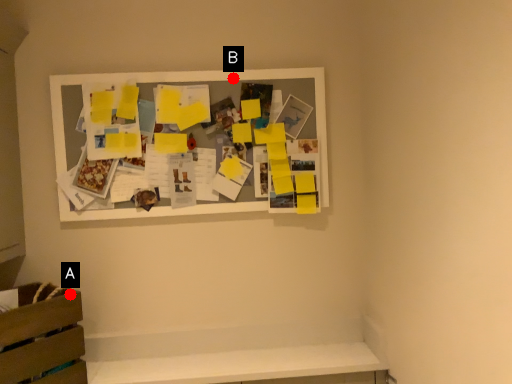
Question: Two points are circled on the image, labeled by A and B beside each circle. Which point is closer to the camera?

Choices:
 (A) A is closer
 (B) B is closer

Answer: (A)